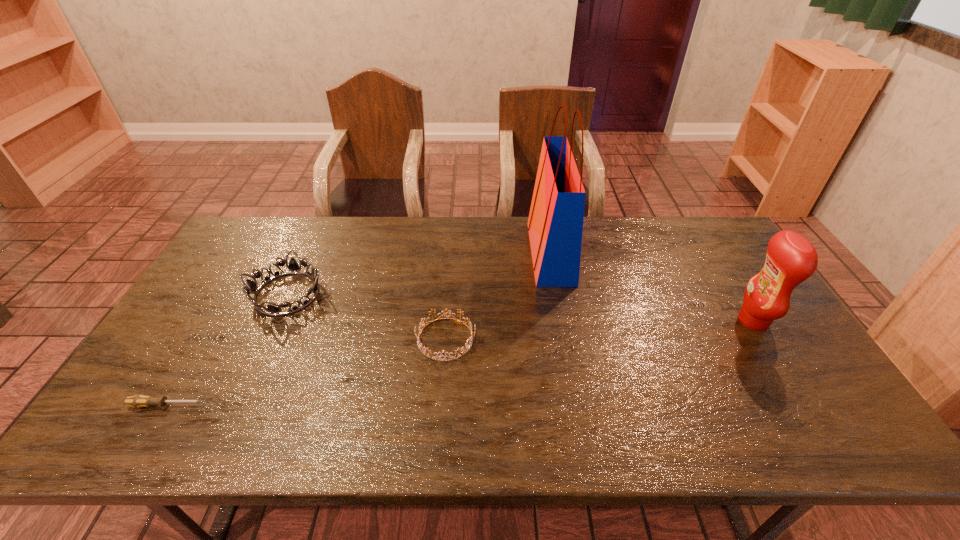
Image resolution: width=960 pixels, height=540 pixels. I want to click on tiara that is at the left edge, so click(293, 266).

I want to click on screwdriver situated at the left edge, so click(x=138, y=401).

I want to click on object present at the right edge, so click(791, 259).

You are a GUI agent. You are given a task and a screenshot of the screen. Output one action in this format:
    pyautogui.click(x=<x>, y=<y>)
    Task: Click on the vacant space at the far edge of the desktop
    The image size is (960, 540).
    Given the screenshot: What is the action you would take?
    pyautogui.click(x=656, y=216)

The height and width of the screenshot is (540, 960). I want to click on blank area at the near edge, so click(472, 436).

Find the location of a particular element. vacant space at the left edge of the desktop is located at coordinates (222, 310).

In the image, there is a desktop. Where is `free space at the right edge`? free space at the right edge is located at coordinates click(x=690, y=261).

The height and width of the screenshot is (540, 960). Identify the location of vacant space at the far left corner of the desktop. (239, 257).

In order to click on vacant area that lies between the taller tiara and the shorter tiara in this screenshot , I will do `click(367, 316)`.

The height and width of the screenshot is (540, 960). Find the location of `vacant area that lies between the left tiara and the fourth object from left to right`. vacant area that lies between the left tiara and the fourth object from left to right is located at coordinates click(x=419, y=273).